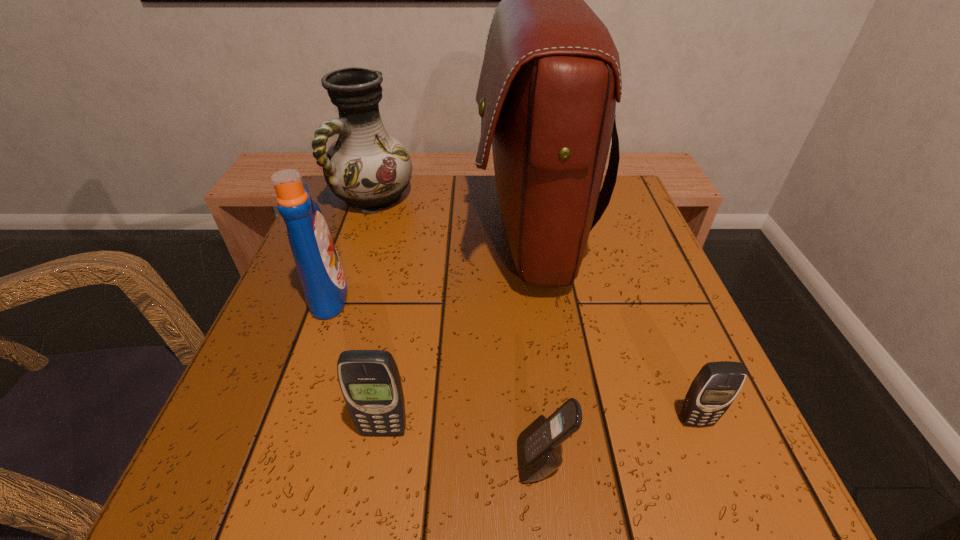
You are a GUI agent. You are given a task and a screenshot of the screen. Output one action in this format:
    pyautogui.click(x=<x>, y=<y>)
    Task: Click on the free spot between the nearest cellular telephone and the detergent
    
    Given the screenshot: What is the action you would take?
    pyautogui.click(x=436, y=377)

This screenshot has height=540, width=960. Find the location of `vacant area that lies between the vase and the leftmost cellular telephone`. vacant area that lies between the vase and the leftmost cellular telephone is located at coordinates (378, 315).

You are a GUI agent. You are given a task and a screenshot of the screen. Output one action in this format:
    pyautogui.click(x=<x>, y=<y>)
    Task: Click on the free area in between the detergent and the tallest object
    
    Given the screenshot: What is the action you would take?
    pyautogui.click(x=429, y=264)

Locate which object ranks second in proximity to the tallest cellular telephone. Please provide its 2D coordinates. Your answer should be formatted as a tuple, i.e. [(x, y)], where the tuple contains the x and y coordinates of a point satisfying the conditions above.

[(319, 268)]

What are the coordinates of `object that is the fifth closest to the rightmost object` in the screenshot? It's located at (368, 169).

At what (x,y) coordinates should I click in order to perform the action: click on the second closest cellular telephone relative to the leftmost cellular telephone. Please return your answer as a coordinate pair (x, y). Image resolution: width=960 pixels, height=540 pixels. Looking at the image, I should click on (713, 390).

Select which cellular telephone is the second closest to the rightmost object. Please provide its 2D coordinates. Your answer should be formatted as a tuple, i.e. [(x, y)], where the tuple contains the x and y coordinates of a point satisfying the conditions above.

[(369, 380)]